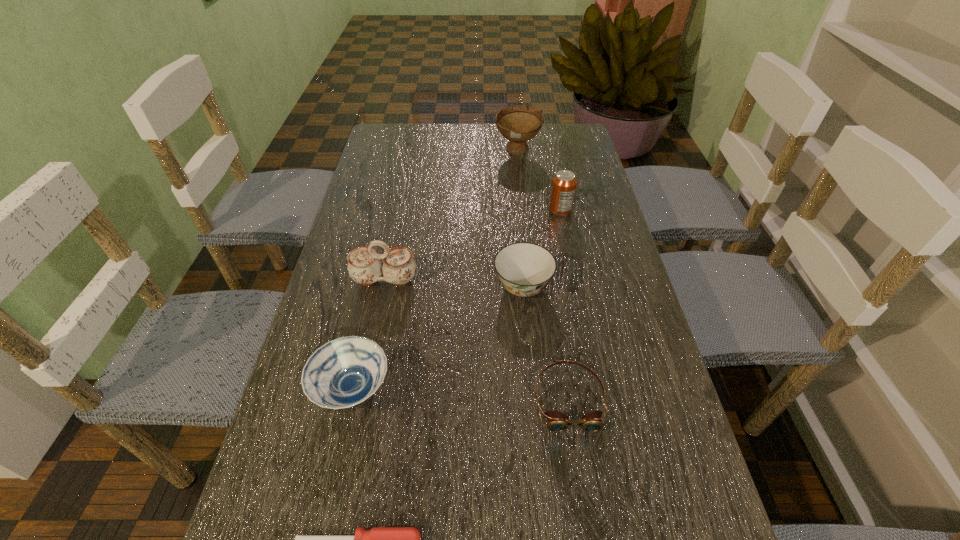
This screenshot has height=540, width=960. I want to click on blank space located 0.070m on the right of the second nearest soup bowl, so click(x=581, y=287).

Where is `vacant space located 0.140m on the right of the leftmost soup bowl`? Image resolution: width=960 pixels, height=540 pixels. vacant space located 0.140m on the right of the leftmost soup bowl is located at coordinates (462, 390).

Where is `vacant space located through the lenses of the sixth tallest object`? The height and width of the screenshot is (540, 960). vacant space located through the lenses of the sixth tallest object is located at coordinates (588, 522).

Where is `object at the far edge`? This screenshot has width=960, height=540. object at the far edge is located at coordinates (519, 123).

This screenshot has width=960, height=540. I want to click on chinaware located in the left edge section of the desktop, so click(398, 267).

Where is `soup bowl that is at the left edge`? soup bowl that is at the left edge is located at coordinates (344, 372).

The height and width of the screenshot is (540, 960). What are the coordinates of `can located at the right edge` in the screenshot? It's located at (563, 187).

Find the location of a particular element. This screenshot has height=540, width=960. goggles positioned at the right edge is located at coordinates (556, 421).

In the image, there is a desktop. Where is `vacant space at the far edge`? The height and width of the screenshot is (540, 960). vacant space at the far edge is located at coordinates (499, 142).

Image resolution: width=960 pixels, height=540 pixels. I want to click on free space at the left edge of the desktop, so click(393, 292).